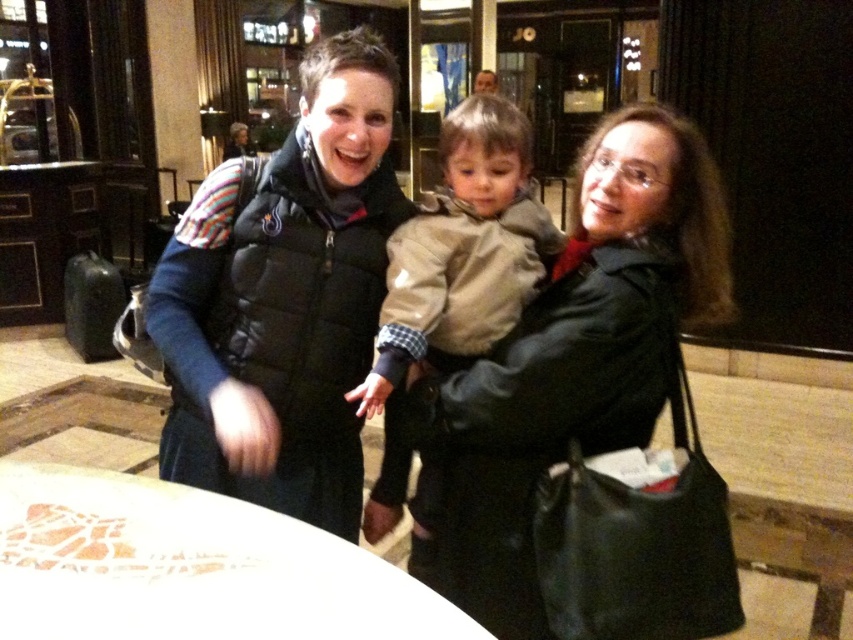
Question: Can you confirm if black puffer vest at center is bigger than tan fabric jacket at center?

Choices:
 (A) no
 (B) yes

Answer: (B)

Question: Is black puffer vest at center to the left of matte black coat at center from the viewer's perspective?

Choices:
 (A) yes
 (B) no

Answer: (A)

Question: Among these objects, which one is nearest to the camera?

Choices:
 (A) smooth brown hair at upper center
 (B) tan fabric jacket at center
 (C) black puffer vest at center

Answer: (C)

Question: Which point appears farthest from the camera in this image?

Choices:
 (A) (277, 164)
 (B) (483, 419)
 (C) (485, 72)

Answer: (C)

Question: Among these objects, which one is farthest from the camera?

Choices:
 (A) smooth brown hair at upper center
 (B) tan fabric jacket at center
 (C) matte black coat at center

Answer: (A)

Question: Can you confirm if black puffer vest at center is positioned below smooth brown hair at upper center?

Choices:
 (A) no
 (B) yes

Answer: (B)